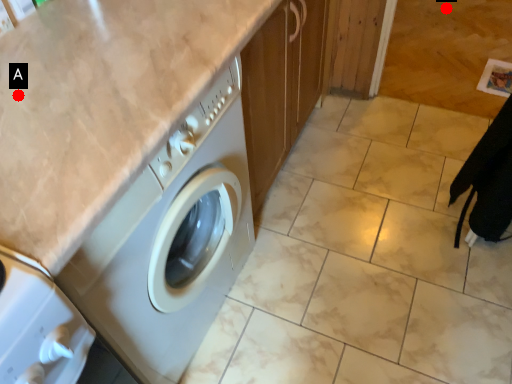
Question: Two points are circled on the image, labeled by A and B beside each circle. Which point is closer to the camera?

Choices:
 (A) A is closer
 (B) B is closer

Answer: (A)